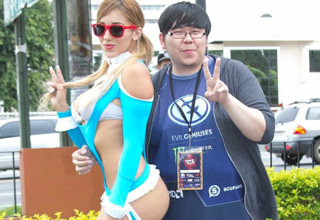
Find the location of `window`. window is located at coordinates (260, 61), (316, 60), (266, 15), (153, 7), (151, 20).